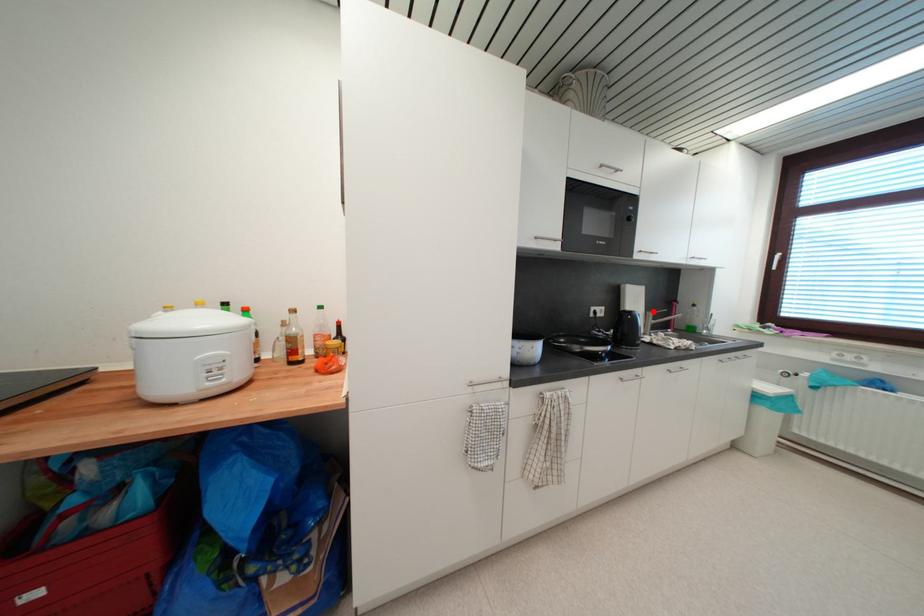
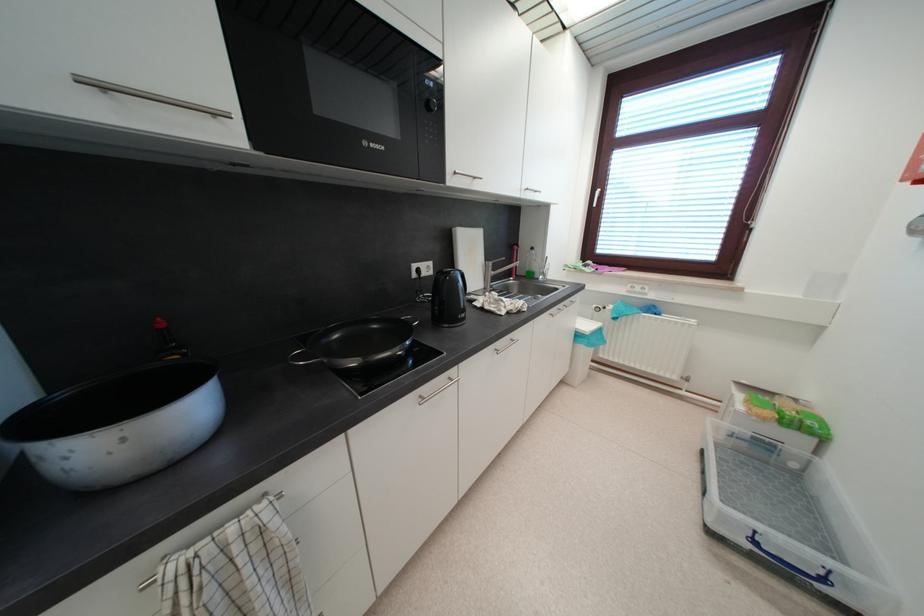
Locate, in the second image, the point that corresponds to the highlighted location in the first image.

(492, 261)